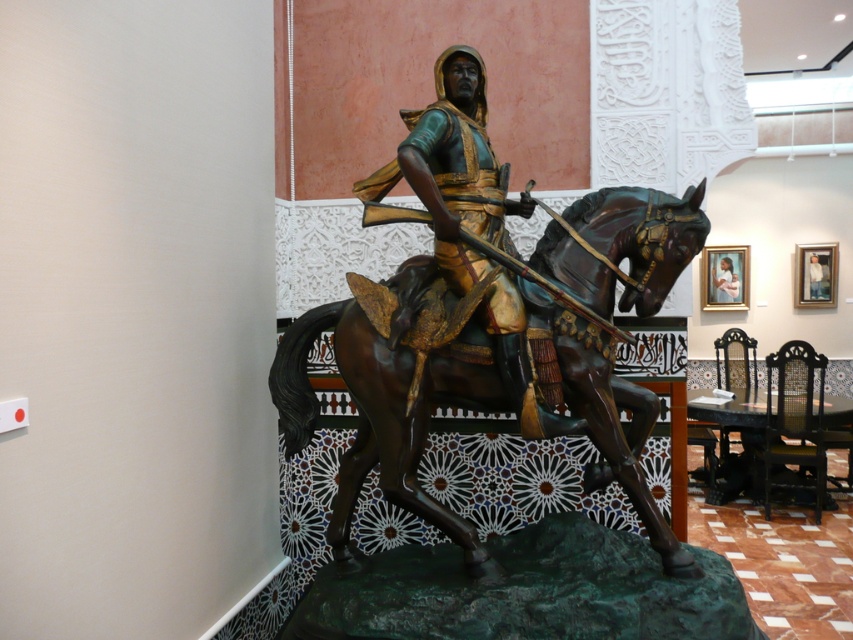
Question: Among these points, which one is farthest from the camera?

Choices:
 (A) (479, 224)
 (B) (805, 298)

Answer: (B)

Question: Is bronze statue at center to the left of matte gold armor at center from the viewer's perspective?

Choices:
 (A) yes
 (B) no

Answer: (B)

Question: Among these objects, which one is farthest from the camera?

Choices:
 (A) matte gold armor at center
 (B) green patina armor at center
 (C) bronze statue at center
 (D) bronze/golden at center

Answer: (A)

Question: Is bronze/golden at center in front of matte gold armor at center?

Choices:
 (A) no
 (B) yes

Answer: (B)

Question: Is bronze/golden at center to the left of matte gold armor at center from the viewer's perspective?

Choices:
 (A) no
 (B) yes

Answer: (B)

Question: Which point appears farthest from the camera in this image?

Choices:
 (A) (822, 275)
 (B) (717, 275)
 (C) (462, 102)
 (D) (665, 518)

Answer: (B)